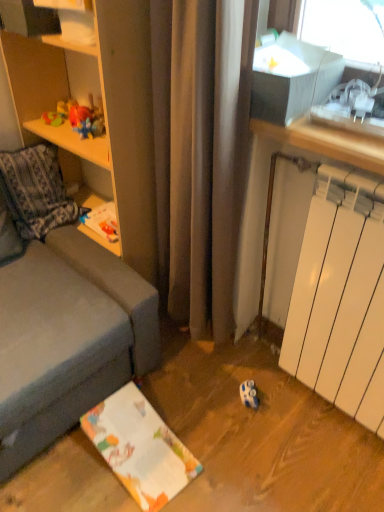
At what (x,y) coordinates should I click in order to perform the action: click on wooden shelf at left. Please return your answer as a coordinate pair (x, y). Looking at the image, I should click on (54, 98).

This screenshot has width=384, height=512. Identify the location of plush orange bear at upper left. (78, 118).

Can you see wooden shelf at left touching plush orange bear at upper left?

wooden shelf at left is not next to plush orange bear at upper left, and they're not touching.

Is wooden shelf at left thinner than plush orange bear at upper left?

No, wooden shelf at left is not thinner than plush orange bear at upper left.

Is wooden shelf at left inside or outside of plush orange bear at upper left?

wooden shelf at left exists outside the volume of plush orange bear at upper left.

In order to click on toy that is on the left side of wooden shelf at left in this screenshot , I will do `click(78, 118)`.

Identify the location of cabinetry located below the white glossy shelf at upper left (from the image's perspective). (54, 98).

From a real-world perspective, which is physically below, wooden shelf at left or white glossy shelf at upper left?

wooden shelf at left.

Is wooden shelf at left at the left side of white glossy shelf at upper left?

No.

From the image's perspective, relative to white glossy shelf at upper left, is wooden shelf at left above or below?

wooden shelf at left is below white glossy shelf at upper left.

Is wooden shelf at left located outside white matte radiator at lower right?

Absolutely, wooden shelf at left is external to white matte radiator at lower right.

Which object is further away from the camera, wooden shelf at left or white matte radiator at lower right?

wooden shelf at left is further from the camera.

Can you tell me how much white glossy shelf at upper left and white matte radiator at lower right differ in facing direction?

The angular difference between white glossy shelf at upper left and white matte radiator at lower right is 2.71 degrees.

Considering the positions of points (11, 26) and (369, 184), is point (11, 26) farther from camera compared to point (369, 184)?

Yes, point (11, 26) is behind point (369, 184).

The width and height of the screenshot is (384, 512). In order to click on shelf lying above the white matte radiator at lower right (from the image's perspective) in this screenshot , I will do `click(29, 18)`.

Is white glossy shelf at upper left turned away from white matte radiator at lower right?

That's not correct — white glossy shelf at upper left is not looking away from white matte radiator at lower right.

Is point (326, 205) positioned in front of point (56, 133)?

Yes, it is in front of point (56, 133).

Does white matte radiator at lower right appear on the right side of wooden shelf at left?

Indeed, white matte radiator at lower right is positioned on the right side of wooden shelf at left.

Who is taller, white matte radiator at lower right or wooden shelf at left?

Standing taller between the two is wooden shelf at left.

Is white matte radiator at lower right completely or partially outside of wooden shelf at left?

Yes, white matte radiator at lower right is not within wooden shelf at left.

Looking at this image, from a real-world perspective, which object stands above the other?

white glossy shelf at upper left.

Is point (69, 102) less distant than point (75, 11)?

That is False.

Looking at this image, from the image's perspective, is plush orange bear at upper left over white glossy shelf at upper left?

No, from the image's perspective, plush orange bear at upper left is not over white glossy shelf at upper left.

Looking at this image, is plush orange bear at upper left positioned beyond the bounds of white glossy shelf at upper left?

Yes, plush orange bear at upper left is located beyond the bounds of white glossy shelf at upper left.

Which point is more distant from viewer, (367,325) or (59,117)?

Point (59,117)

Is white matte radiator at lower right positioned behind plush orange bear at upper left?

No, white matte radiator at lower right is in front of plush orange bear at upper left.

Does white matte radiator at lower right have a greater width compared to plush orange bear at upper left?

Yes, white matte radiator at lower right is wider than plush orange bear at upper left.

How far apart are white matte radiator at lower right and plush orange bear at upper left?

They are 3.52 feet apart.

What are the coordinates of `cabinetry that is below the plush orange bear at upper left (from the image's perspective)` in the screenshot? It's located at (54, 98).

Find the location of a particular element. shelf lying above the wooden shelf at left (from the image's perspective) is located at coordinates (29, 18).

Looking at the image, which one is located further to white glossy shelf at upper left, plush orange bear at upper left or white matte radiator at lower right?

white matte radiator at lower right is further to white glossy shelf at upper left.

Which object lies further to the anchor point wooden shelf at left, white glossy shelf at upper left or white matte radiator at lower right?

white matte radiator at lower right.

When comparing their distances from white glossy shelf at upper left, does white matte radiator at lower right or wooden shelf at left seem closer?

Among the two, wooden shelf at left is located nearer to white glossy shelf at upper left.

Based on their spatial positions, is wooden shelf at left or white matte radiator at lower right further from white glossy shelf at upper left?

white matte radiator at lower right is positioned further to the anchor white glossy shelf at upper left.

Considering their positions, is white matte radiator at lower right positioned further to white glossy shelf at upper left than plush orange bear at upper left?

white matte radiator at lower right.

Looking at the image, which one is located further to white matte radiator at lower right, white glossy shelf at upper left or plush orange bear at upper left?

The object further to white matte radiator at lower right is plush orange bear at upper left.

Based on their spatial positions, is plush orange bear at upper left or white glossy shelf at upper left further from white matte radiator at lower right?

plush orange bear at upper left lies further to white matte radiator at lower right than the other object.

Considering their positions, is wooden shelf at left positioned closer to white matte radiator at lower right than plush orange bear at upper left?

wooden shelf at left is closer to white matte radiator at lower right.

This screenshot has width=384, height=512. In order to click on toy between white glossy shelf at upper left and white matte radiator at lower right in the horizontal direction in this screenshot , I will do `click(78, 118)`.

At what (x,y) coordinates should I click in order to perform the action: click on cabinetry between plush orange bear at upper left and white matte radiator at lower right from left to right. Please return your answer as a coordinate pair (x, y). Looking at the image, I should click on (54, 98).

The width and height of the screenshot is (384, 512). I want to click on shelf between wooden shelf at left and plush orange bear at upper left in the front-back direction, so click(29, 18).

Find the location of a particular element. The width and height of the screenshot is (384, 512). cabinetry between white glossy shelf at upper left and white matte radiator at lower right in the horizontal direction is located at coordinates (54, 98).